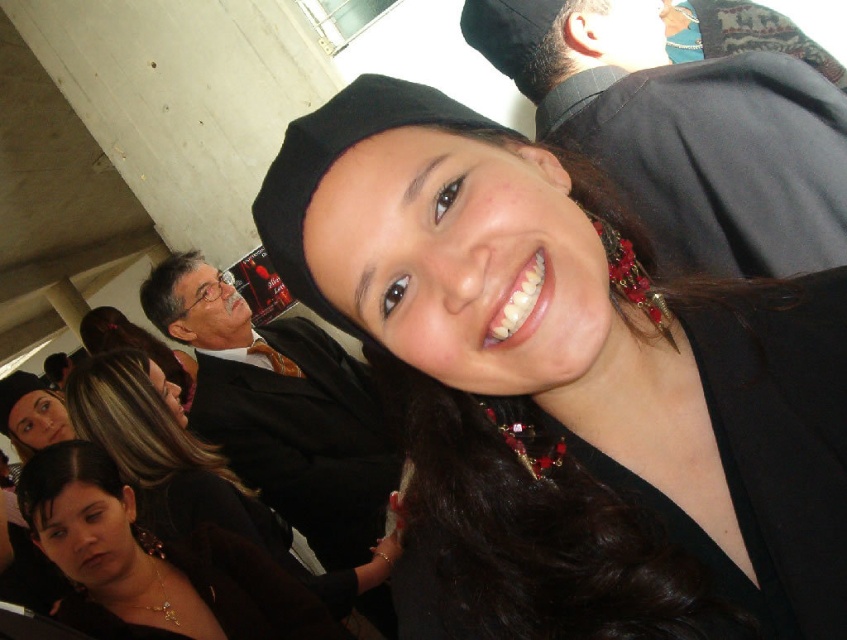
You are a photographer at this graduation ceremony. You need to adjust your camera to focus on the black fabric at upper right and the matte black hair at lower left. Which object should you focus on first to ensure it appears sharp in the photo?

The black fabric at upper right is in front of the matte black hair at lower left, so you should focus on the black fabric at upper right first to ensure it appears sharp.